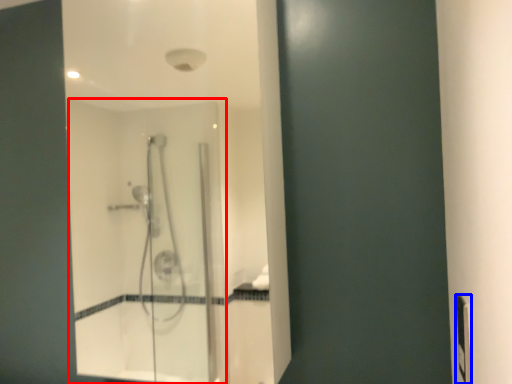
Question: Among these objects, which one is nearest to the camera, screen door (highlighted by a red box) or electric outlet (highlighted by a blue box)?

Choices:
 (A) screen door
 (B) electric outlet

Answer: (B)